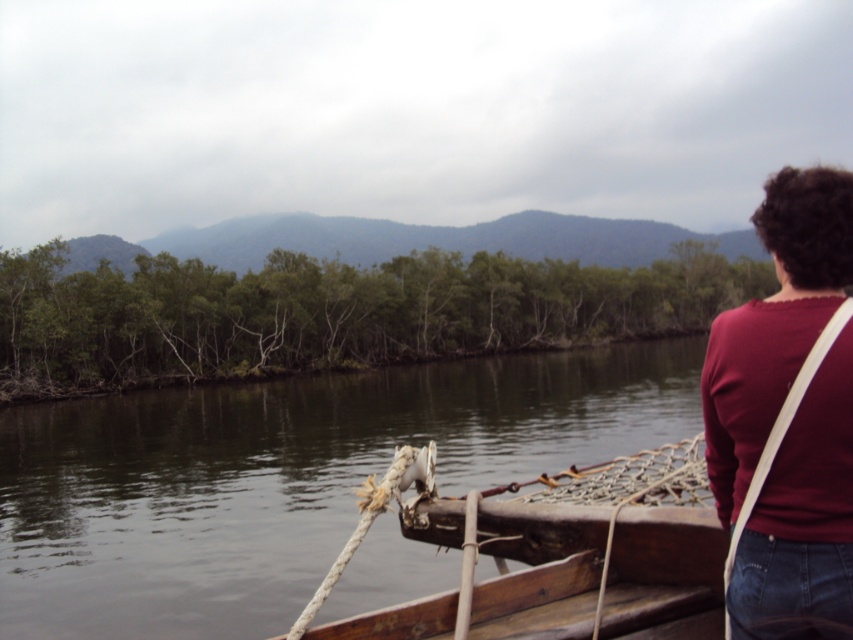
Question: Which point is farther from the camera taking this photo?

Choices:
 (A) tap(561, 483)
 (B) tap(158, 588)

Answer: (B)

Question: From the image, what is the correct spatial relationship of brown wooden boat at center in relation to maroon fabric shirt at upper right?

Choices:
 (A) left
 (B) right

Answer: (B)

Question: Is brown wooden boat at center bigger than wooden boat at center?

Choices:
 (A) no
 (B) yes

Answer: (B)

Question: Which object appears farthest from the camera in this image?

Choices:
 (A) maroon fabric shirt at upper right
 (B) wooden boat at center
 (C) brown wooden boat at center

Answer: (C)

Question: Which point appears farthest from the camera in this image?

Choices:
 (A) (776, 356)
 (B) (554, 365)

Answer: (B)

Question: Can you confirm if brown wooden boat at center is positioned to the left of maroon fabric shirt at upper right?

Choices:
 (A) no
 (B) yes

Answer: (A)